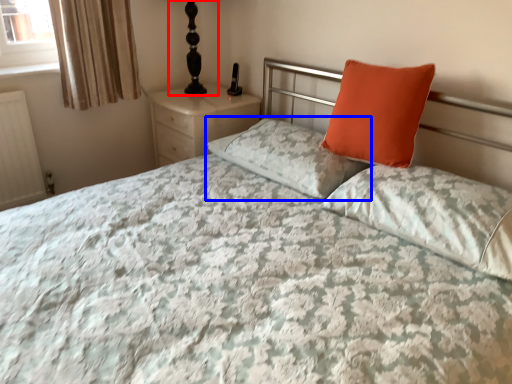
Question: Among these objects, which one is farthest to the camera, table lamp (highlighted by a red box) or pillow (highlighted by a blue box)?

Choices:
 (A) table lamp
 (B) pillow

Answer: (A)